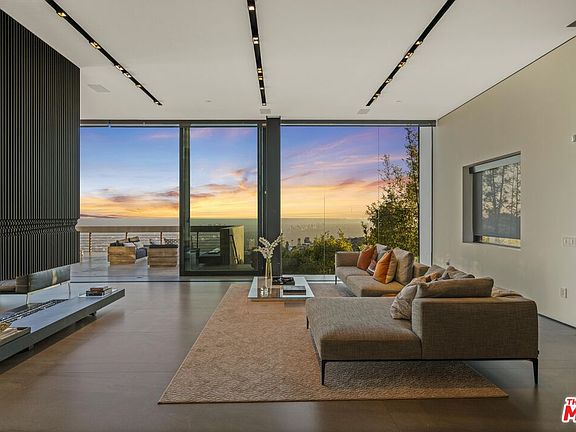
Find the location of a particular element. wood floor is located at coordinates (177, 295), (108, 379), (518, 417), (553, 337).